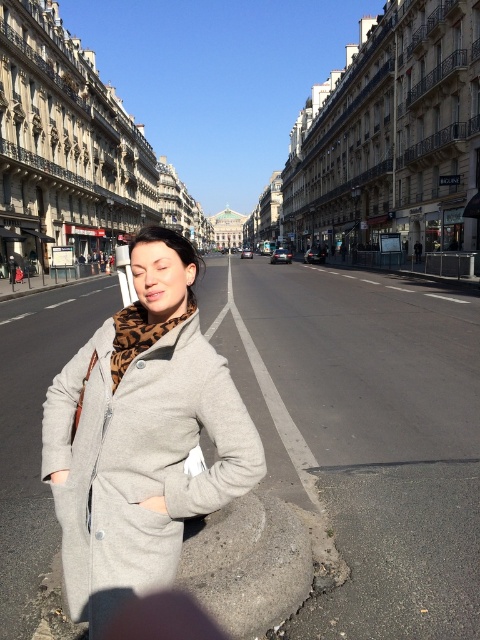
You are a delivery person carrying a package that is 1.2 meters wide. You need to pass through the space between the gray wool coat at center and the smooth concrete curb at lower center. Can your package fit through the space?

The gray wool coat at center might be wider than smooth concrete curb at lower center, so the space between them may not be wide enough for the 1.2 meter wide package. It is uncertain and you should check the actual width before proceeding.